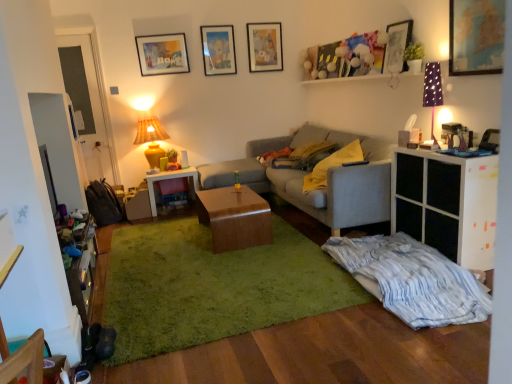
The height and width of the screenshot is (384, 512). Find the location of `blank area to the left of glossy brown coffee table at center`. blank area to the left of glossy brown coffee table at center is located at coordinates (165, 236).